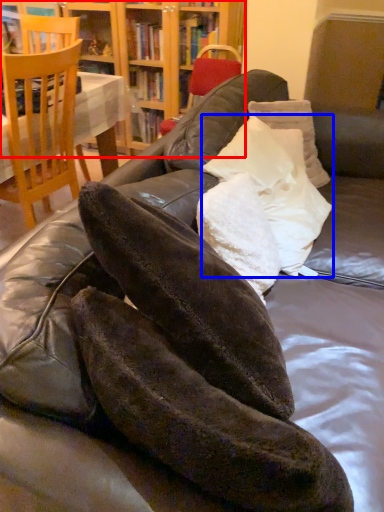
Question: Among these objects, which one is farthest to the camera, bookcase (highlighted by a red box) or pillow (highlighted by a blue box)?

Choices:
 (A) bookcase
 (B) pillow

Answer: (A)